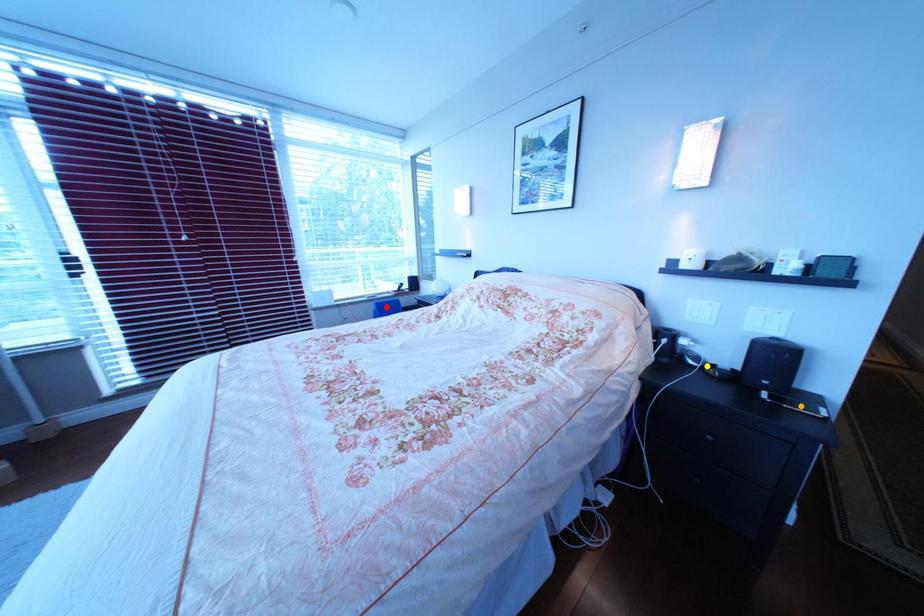
Order these from nearest to farthest:
1. yellow point
2. orange point
3. red point

orange point < yellow point < red point